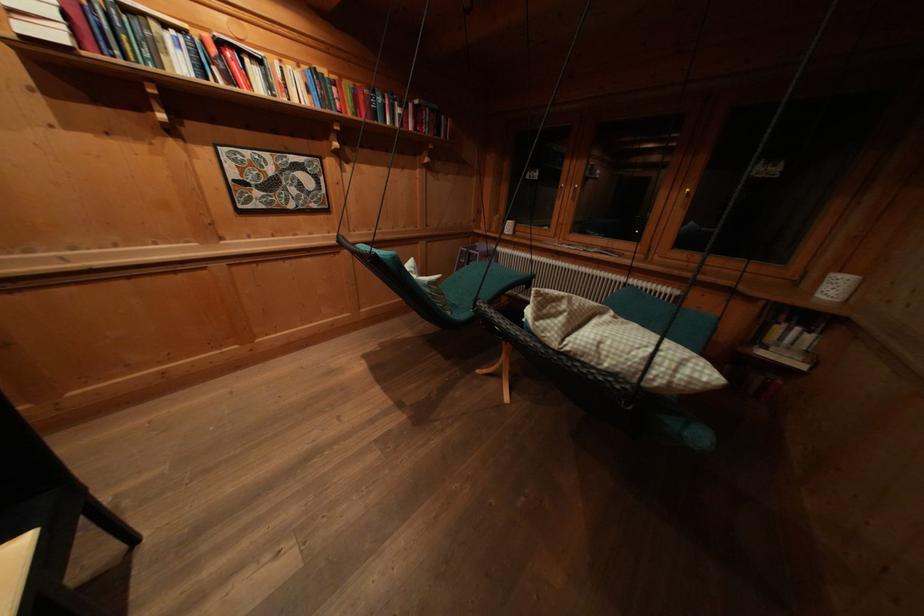
This screenshot has width=924, height=616. What are the coordinates of `chair sitting surface` in the screenshot? It's located at (481, 282).